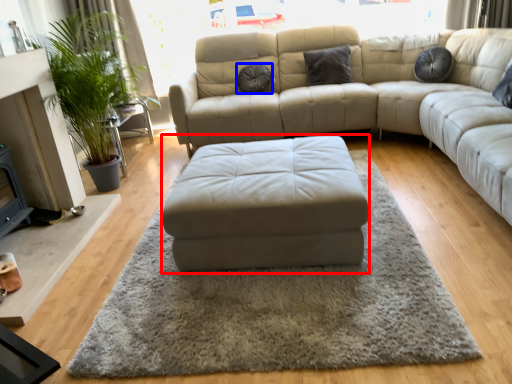
Question: Which point is closer to the camera, footrest (highlighted by a red box) or pillow (highlighted by a blue box)?

Choices:
 (A) footrest
 (B) pillow

Answer: (A)